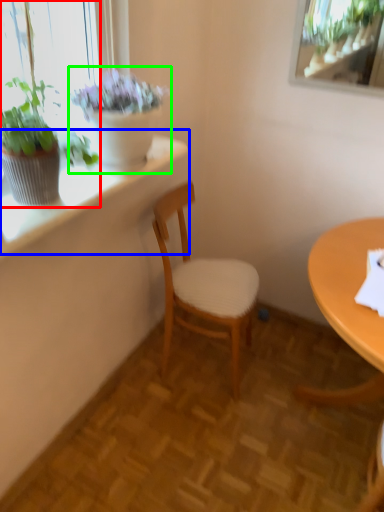
Question: Considering the real-world distances, which object is farthest from houseplant (highlighted by a red box)? window sill (highlighted by a blue box) or houseplant (highlighted by a green box)?

Choices:
 (A) window sill
 (B) houseplant

Answer: (A)